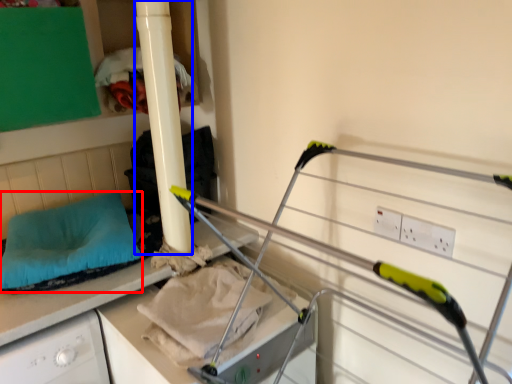
Question: Which object is closer to the camera taking this photo, pillow (highlighted by a red box) or pillar (highlighted by a blue box)?

Choices:
 (A) pillow
 (B) pillar

Answer: (B)